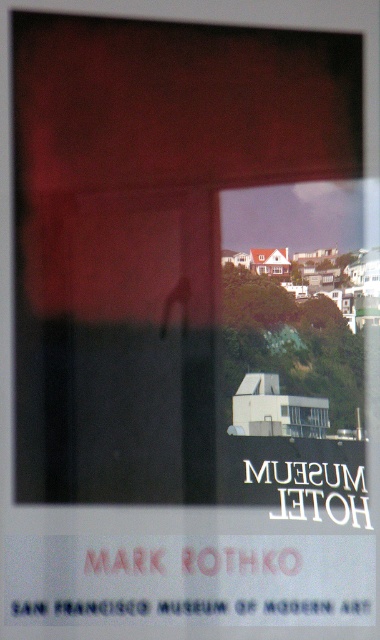
Question: Does transparent glass window at center have a smaller size compared to matte glass window at center?

Choices:
 (A) yes
 (B) no

Answer: (B)

Question: From the image, what is the correct spatial relationship of transparent glass window at center in relation to matte glass window at center?

Choices:
 (A) right
 (B) left

Answer: (A)

Question: Which of the following is the farthest from the observer?

Choices:
 (A) transparent glass window at center
 (B) matte glass window at center

Answer: (A)

Question: Does transparent glass window at center appear under matte glass window at center?

Choices:
 (A) no
 (B) yes

Answer: (B)

Question: Among these objects, which one is nearest to the camera?

Choices:
 (A) transparent glass window at center
 (B) matte glass window at center

Answer: (B)